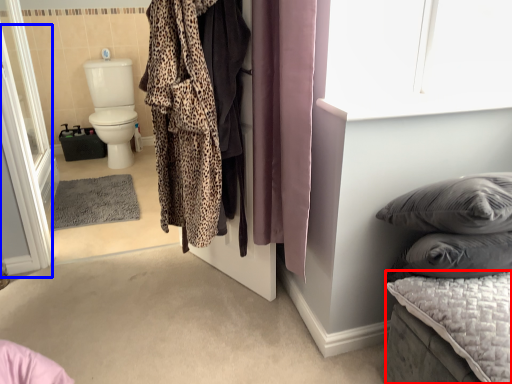
Question: Which object is closer to the camera taking this photo, mattress (highlighted by a red box) or screen door (highlighted by a blue box)?

Choices:
 (A) mattress
 (B) screen door

Answer: (A)